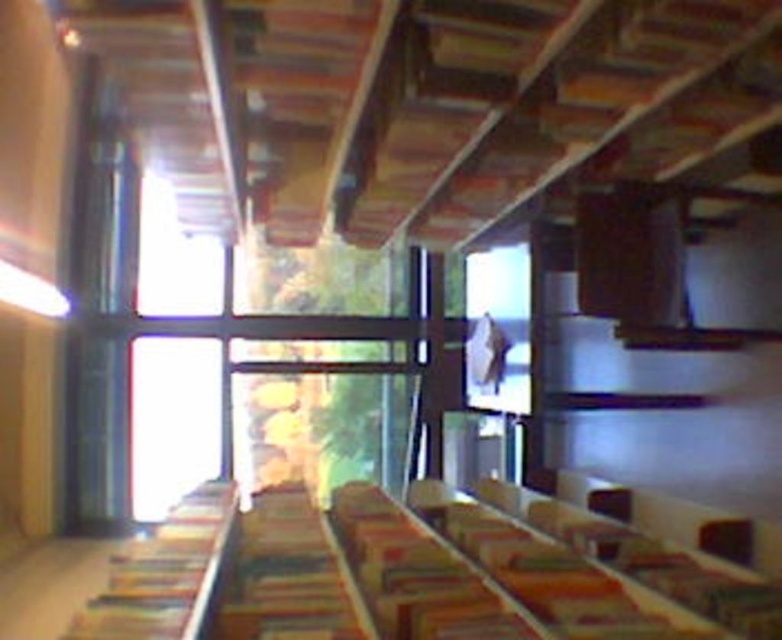
Question: Is multicolored fabric book at center wider than hardcover book at left?

Choices:
 (A) yes
 (B) no

Answer: (A)

Question: Which point is closer to the camera?

Choices:
 (A) multicolored fabric book at center
 (B) hardcover book at left

Answer: (B)

Question: Is multicolored fabric book at center closer to the viewer compared to hardcover book at left?

Choices:
 (A) no
 (B) yes

Answer: (A)

Question: Can you confirm if multicolored fabric book at center is positioned below hardcover book at left?

Choices:
 (A) yes
 (B) no

Answer: (A)

Question: Which point is farther from the camera taking this photo?

Choices:
 (A) (314, 512)
 (B) (206, 589)

Answer: (A)